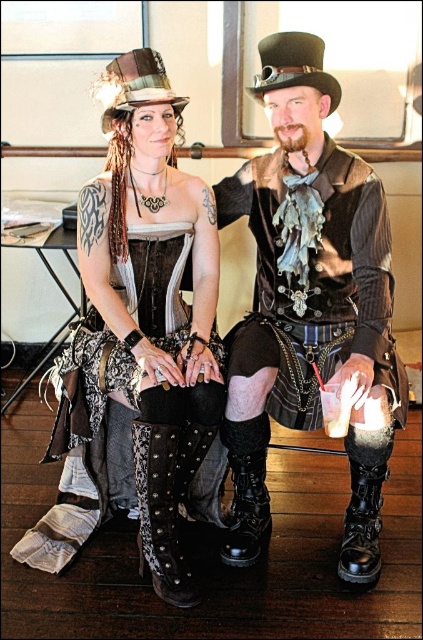
Question: Is black leather boot at lower right smaller than black leather boot at center?

Choices:
 (A) no
 (B) yes

Answer: (B)

Question: Which of these objects is positioned closest to the shiny leather vest at center?

Choices:
 (A) leather boots at center
 (B) black leather boot at center
 (C) suede studded boot at lower center
 (D) black leather boot at lower right

Answer: (B)

Question: Is black leather boot at lower right below black leather boot at center?

Choices:
 (A) no
 (B) yes

Answer: (B)

Question: Is black leather boot at lower right to the left of black leather boot at center from the viewer's perspective?

Choices:
 (A) yes
 (B) no

Answer: (B)

Question: Estimate the real-world distances between objects in this image. Which object is closer to the shiny leather vest at center?

Choices:
 (A) black leather boot at center
 (B) leather boots at center

Answer: (A)

Question: Which object is the closest to the leather boots at center?

Choices:
 (A) suede studded boot at lower center
 (B) black leather boot at lower right

Answer: (A)